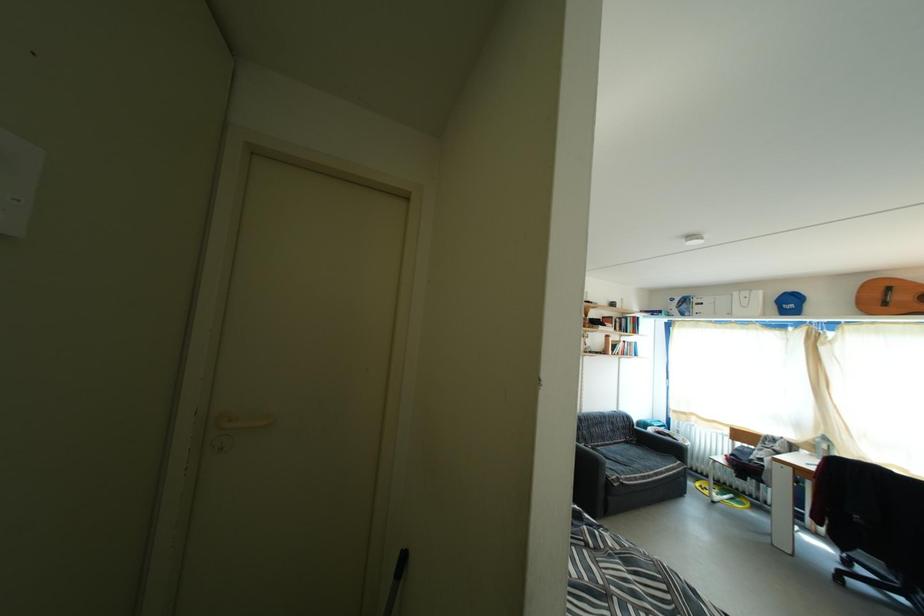
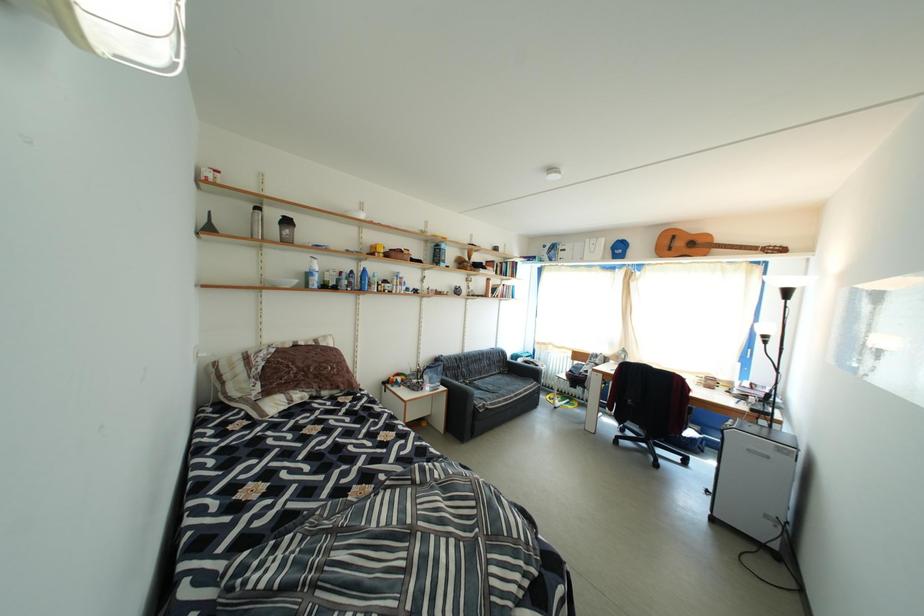
What movement of the cameraman would produce the second image?

The cameraman walked toward right, forward.